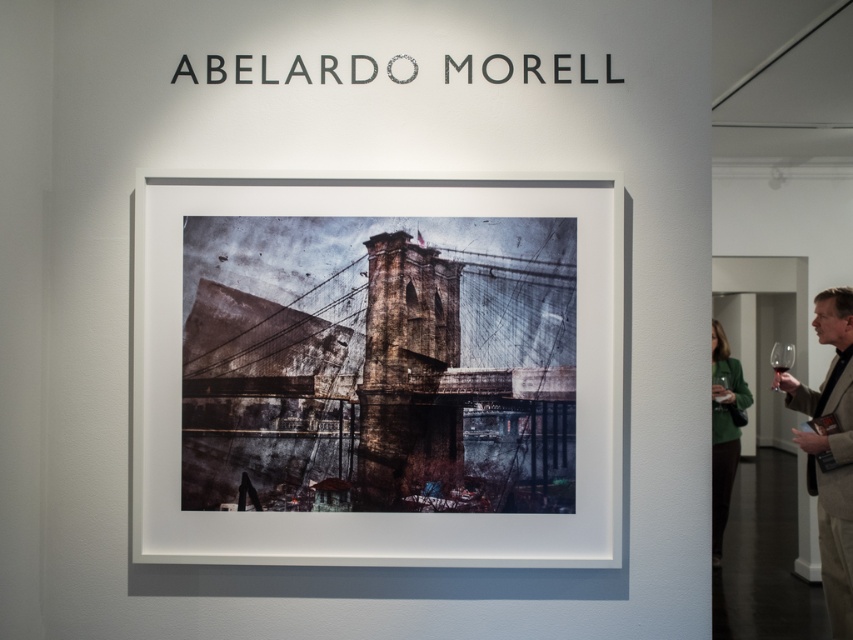
Question: Does brown leather jacket at lower right have a larger size compared to transparent glass at right?

Choices:
 (A) yes
 (B) no

Answer: (A)

Question: Is brown leather jacket at lower right in front of transparent glass at center?

Choices:
 (A) no
 (B) yes

Answer: (B)

Question: Which of the following is the closest to the observer?

Choices:
 (A) transparent glass at right
 (B) green fabric coat at right

Answer: (A)

Question: Which of the following is the farthest from the observer?

Choices:
 (A) (378, 314)
 (B) (775, 371)

Answer: (B)

Question: Which object is closer to the camera taking this photo?

Choices:
 (A) green fabric coat at right
 (B) brown leather jacket at lower right
 (C) sepia-toned photograph of brooklyn bridge at center
 (D) transparent glass at right

Answer: (C)

Question: Is brown leather jacket at lower right in front of transparent glass at center?

Choices:
 (A) no
 (B) yes

Answer: (B)